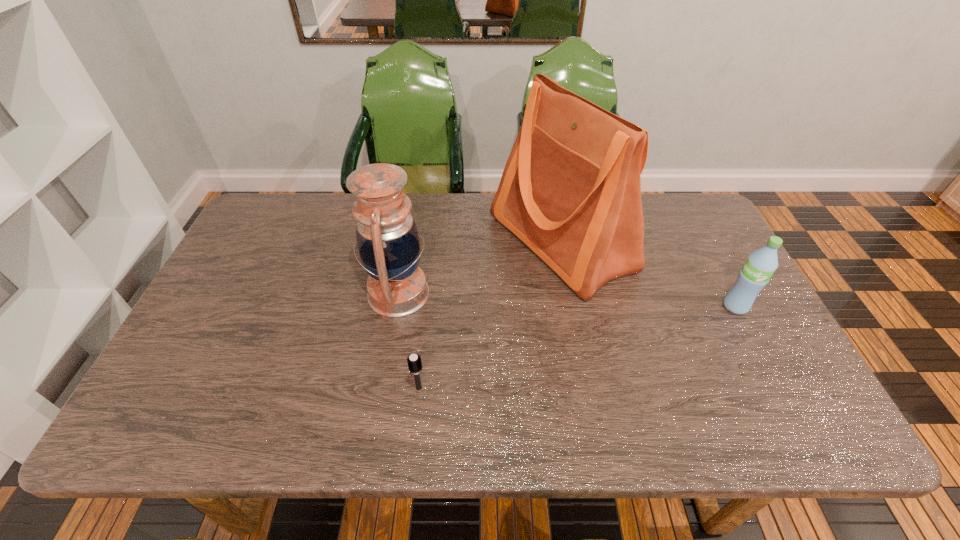
This screenshot has width=960, height=540. I want to click on shopping bag, so click(571, 188).

Image resolution: width=960 pixels, height=540 pixels. I want to click on the second tallest object, so click(x=387, y=237).

Image resolution: width=960 pixels, height=540 pixels. Identify the location of water bottle. (761, 264).

The height and width of the screenshot is (540, 960). I want to click on the rightmost object, so click(x=761, y=264).

I want to click on the shortest object, so click(414, 361).

Locate an element on the screen. The width and height of the screenshot is (960, 540). the nearest object is located at coordinates (414, 361).

Find the location of `vacant space situated on the right of the shopping bag`. vacant space situated on the right of the shopping bag is located at coordinates (708, 242).

In order to click on vacant space located on the right of the oil lamp in this screenshot , I will do `click(484, 293)`.

Where is `free point located 0.080m on the back of the second shortest object`? free point located 0.080m on the back of the second shortest object is located at coordinates (720, 276).

At what (x,y) coordinates should I click in order to perform the action: click on free space located on the left of the shortest object. Please return your answer as a coordinate pair (x, y). The width and height of the screenshot is (960, 540). Looking at the image, I should click on (274, 388).